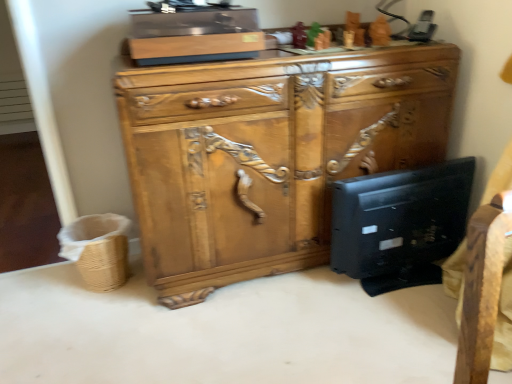
Where is `free spot to the left of black matte desktop computer at lower right`? The width and height of the screenshot is (512, 384). free spot to the left of black matte desktop computer at lower right is located at coordinates (300, 302).